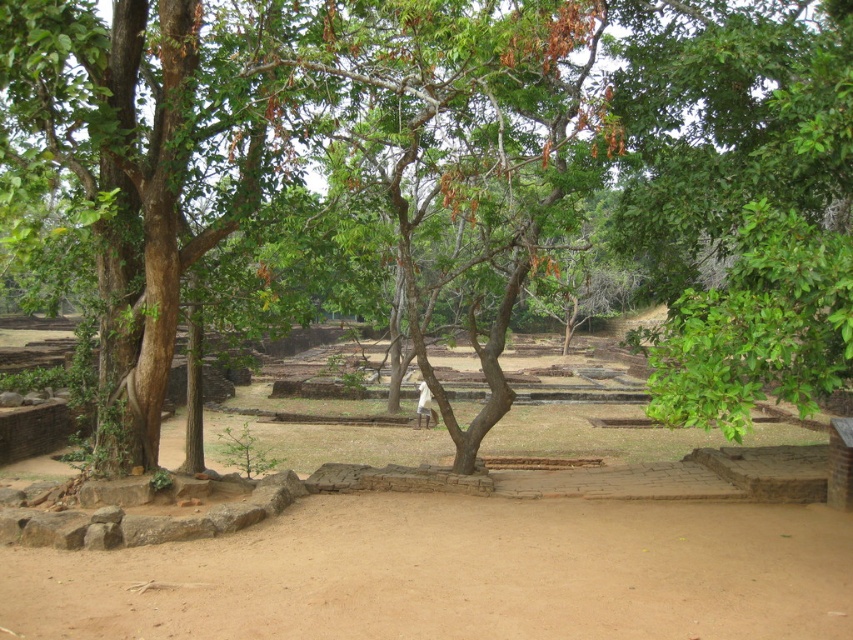
Question: Can you confirm if brown dirt field at center is positioned below brown dirt field at lower center?

Choices:
 (A) no
 (B) yes

Answer: (B)

Question: Which point is farther to the camera?

Choices:
 (A) brown dirt field at center
 (B) brown dirt field at lower center

Answer: (B)

Question: Observing the image, what is the correct spatial positioning of brown dirt field at center in reference to brown dirt field at lower center?

Choices:
 (A) above
 (B) below

Answer: (B)

Question: Considering the relative positions of brown dirt field at center and brown dirt field at lower center in the image provided, where is brown dirt field at center located with respect to brown dirt field at lower center?

Choices:
 (A) below
 (B) above

Answer: (A)